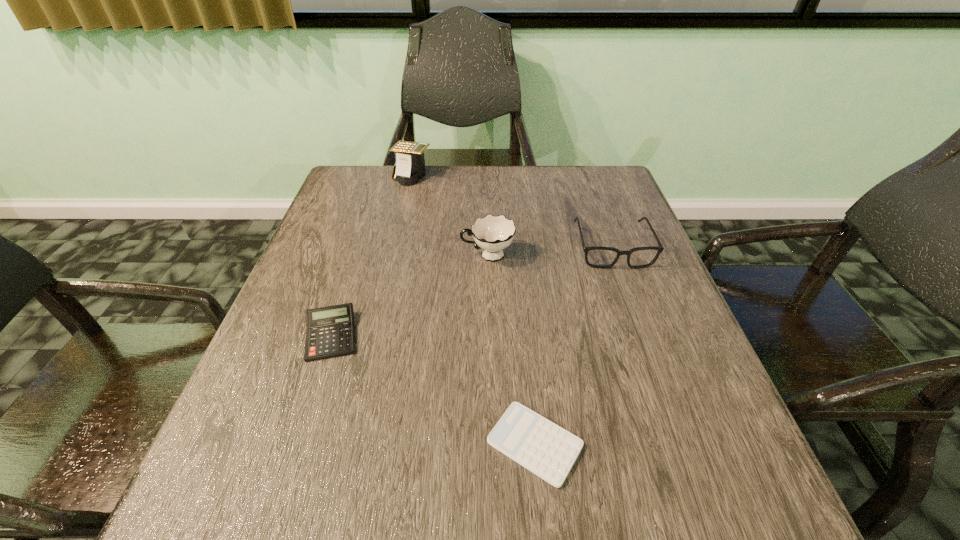
This screenshot has height=540, width=960. In order to click on vacant area at the far edge of the desktop in this screenshot , I will do `click(515, 181)`.

You are a GUI agent. You are given a task and a screenshot of the screen. Output one action in this format:
    pyautogui.click(x=<x>, y=<y>)
    Task: Click on the vacant area at the left edge of the desktop
    The image size is (960, 540).
    Given the screenshot: What is the action you would take?
    pyautogui.click(x=293, y=289)

Identify the location of free space at the right edge of the desktop. Image resolution: width=960 pixels, height=540 pixels. (589, 242).

This screenshot has width=960, height=540. I want to click on free region at the far right corner of the desktop, so click(x=612, y=197).

Identify the location of free space between the second nearest object and the spectacles. The height and width of the screenshot is (540, 960). (471, 292).

You are a GUI agent. You are given a task and a screenshot of the screen. Output one action in this format:
    pyautogui.click(x=<x>, y=<y>)
    Task: Click on the free space between the tallest calculator and the cup
    The height and width of the screenshot is (540, 960).
    Given the screenshot: What is the action you would take?
    pyautogui.click(x=449, y=216)

This screenshot has height=540, width=960. What are the coordinates of `free space between the cup and the second nearest calculator` in the screenshot? It's located at (409, 295).

In order to click on free space that is in between the second tallest calculator and the cup in this screenshot , I will do `click(409, 295)`.

Where is `free space between the cup and the shortest calculator`? The width and height of the screenshot is (960, 540). free space between the cup and the shortest calculator is located at coordinates (511, 349).

Where is `free space between the rightmost object and the second nearest calculator`? free space between the rightmost object and the second nearest calculator is located at coordinates (471, 292).